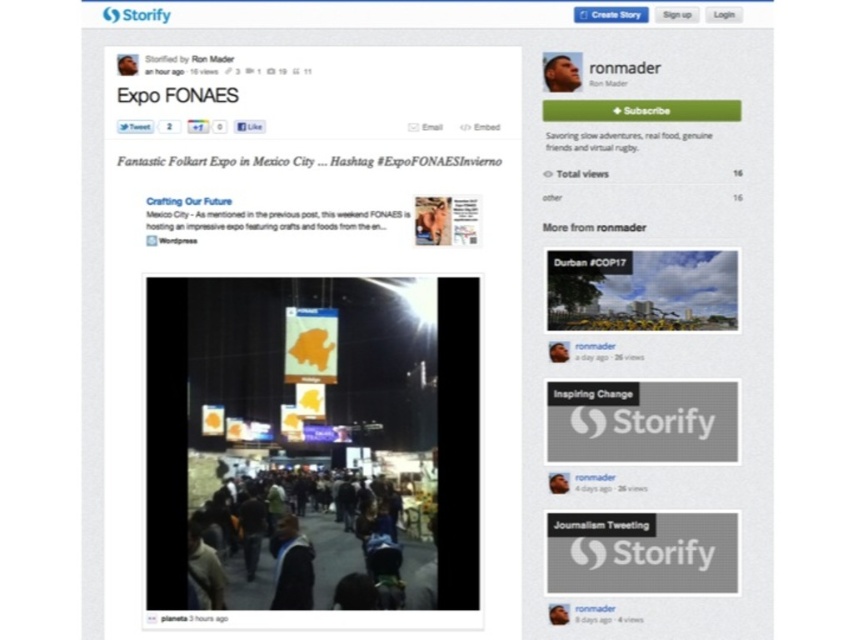
Does point (340, 552) come in front of point (554, 80)?

Yes, it is.

Is dark clothing at center to the right of smooth skin face at upper right from the viewer's perspective?

No, dark clothing at center is not to the right of smooth skin face at upper right.

Image resolution: width=853 pixels, height=640 pixels. What do you see at coordinates (329, 554) in the screenshot? I see `dark clothing at center` at bounding box center [329, 554].

Where is `dark clothing at center`? The image size is (853, 640). dark clothing at center is located at coordinates (329, 554).

Who is taller, orange fabric banners at center or dark clothing at center?

With more height is orange fabric banners at center.

Is point (392, 529) closer to viewer compared to point (347, 564)?

No, (392, 529) is behind (347, 564).

Who is more forward, (x=419, y=474) or (x=236, y=600)?

Point (x=236, y=600) is more forward.

In order to click on orange fabric banners at center in this screenshot , I will do `click(309, 440)`.

Can you confirm if orange fabric banners at center is taller than smooth skin face at upper right?

Yes, orange fabric banners at center is taller than smooth skin face at upper right.

Consider the image. Who is taller, orange fabric banners at center or smooth skin face at upper right?

Standing taller between the two is orange fabric banners at center.

The image size is (853, 640). Find the location of `orange fabric banners at center`. orange fabric banners at center is located at coordinates (309, 440).